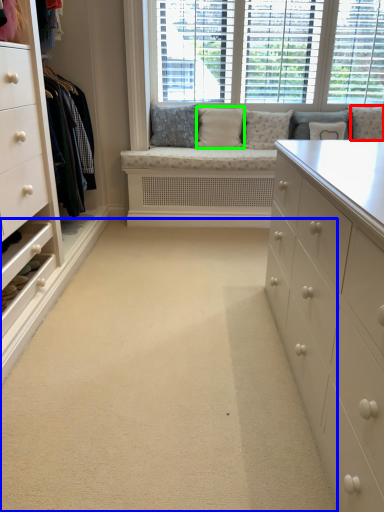
Question: Which is nearer to the pillow (highlighted by a red box)? plain (highlighted by a blue box) or pillow (highlighted by a green box).

Choices:
 (A) plain
 (B) pillow

Answer: (B)